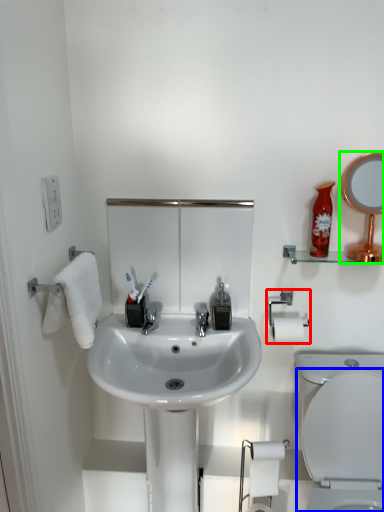
Question: Based on their relative distances, which object is farther from towel bar (highlighted by a red box)? Choose from toilet (highlighted by a blue box) and mirror (highlighted by a green box).

Choices:
 (A) toilet
 (B) mirror

Answer: (A)